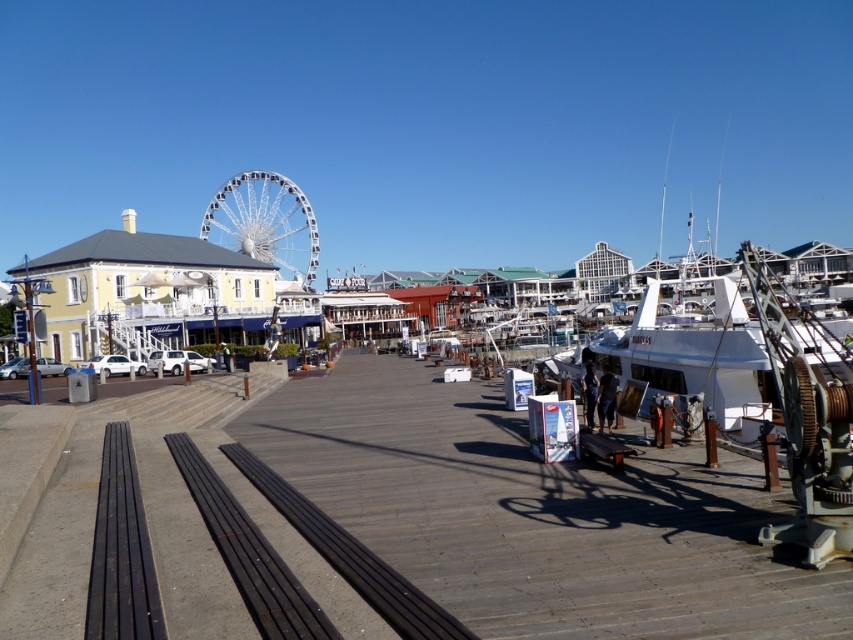
You are planning to place a new bench on the boardwalk. The bench you have is the size of the wooden at center. Can it fit in the space where the white matte boat at right is currently located?

The wooden at center occupies less space than the white matte boat at right, so the bench can fit in the space where the white matte boat at right is located because it requires less space.

Consider the image. You are standing on the boardwalk and want to take a photo of both the white matte boat at right and the white metallic ferris wheel at upper left in the same frame. Which object should you position closer to the edge of the frame to include both?

To include both the white matte boat at right and the white metallic ferris wheel at upper left in the same frame, you should position the white metallic ferris wheel at upper left closer to the edge of the frame since it is located above the white matte boat at right.

Consider the image. You are standing at the point marked by the coordinates point (538,515). Looking around, you see the wooden boardwalk stretching ahead. Which direction should you walk to reach the large white boat docked on the right side of the boardwalk?

Since the point (538,515) marks wooden at center, you are currently standing on the wooden boardwalk at its center. To reach the large white boat docked on the right side of the boardwalk, you should walk to the right along the boardwalk.